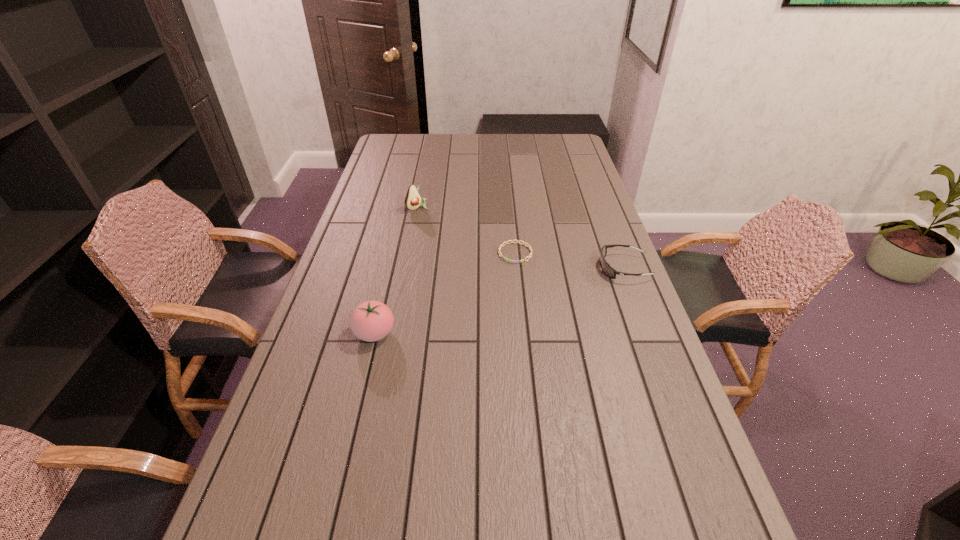
In the image, there is a desktop. Identify the location of vacant space at the right edge. The width and height of the screenshot is (960, 540). (627, 276).

In the image, there is a desktop. At what (x,y) coordinates should I click in order to perform the action: click on vacant space at the far right corner. Please return your answer as a coordinate pair (x, y). Looking at the image, I should click on (555, 153).

At what (x,y) coordinates should I click in order to perform the action: click on vacant point located between the tomato and the second object from right to left. Please return your answer as a coordinate pair (x, y). Looking at the image, I should click on (444, 293).

You are a GUI agent. You are given a task and a screenshot of the screen. Output one action in this format:
    pyautogui.click(x=<x>, y=<y>)
    Task: Click on the empty location between the farthest object and the goggles
    The height and width of the screenshot is (540, 960).
    Given the screenshot: What is the action you would take?
    pyautogui.click(x=520, y=238)

Where is `free space between the tomato and the farthest object`? The image size is (960, 540). free space between the tomato and the farthest object is located at coordinates (396, 271).

Image resolution: width=960 pixels, height=540 pixels. What are the coordinates of `free spot between the avocado and the third object from left to right` in the screenshot? It's located at (467, 231).

Identify the location of vacant area between the nearest object and the avocado. The width and height of the screenshot is (960, 540). (396, 271).

Where is `unoccupied position between the second shortest object and the bracelet`? unoccupied position between the second shortest object and the bracelet is located at coordinates (569, 261).

I want to click on free space between the nearest object and the second object from right to left, so click(444, 293).

Image resolution: width=960 pixels, height=540 pixels. Find the location of `unoccupied area between the goggles and the bracelet`. unoccupied area between the goggles and the bracelet is located at coordinates (569, 261).